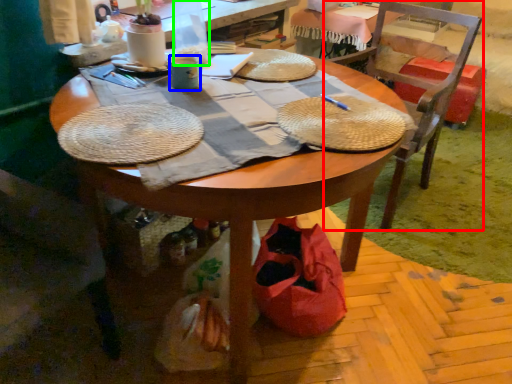
Question: Which object is the closest to the chair (highlighted by a red box)? Choose among these: coffee cup (highlighted by a blue box) or bottle (highlighted by a green box).

Choices:
 (A) coffee cup
 (B) bottle

Answer: (B)